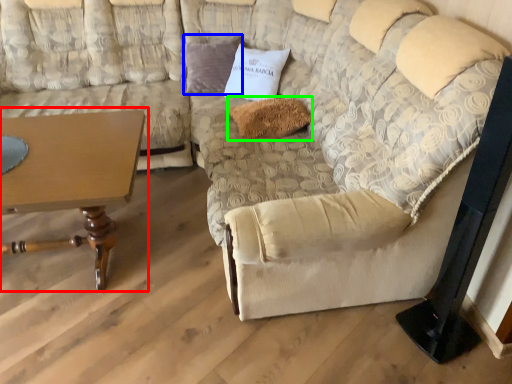
Question: Estimate the real-world distances between objects in this image. Which object is closer to table (highlighted by a red box), pillow (highlighted by a blue box) or pillow (highlighted by a green box)?

Choices:
 (A) pillow
 (B) pillow

Answer: (B)